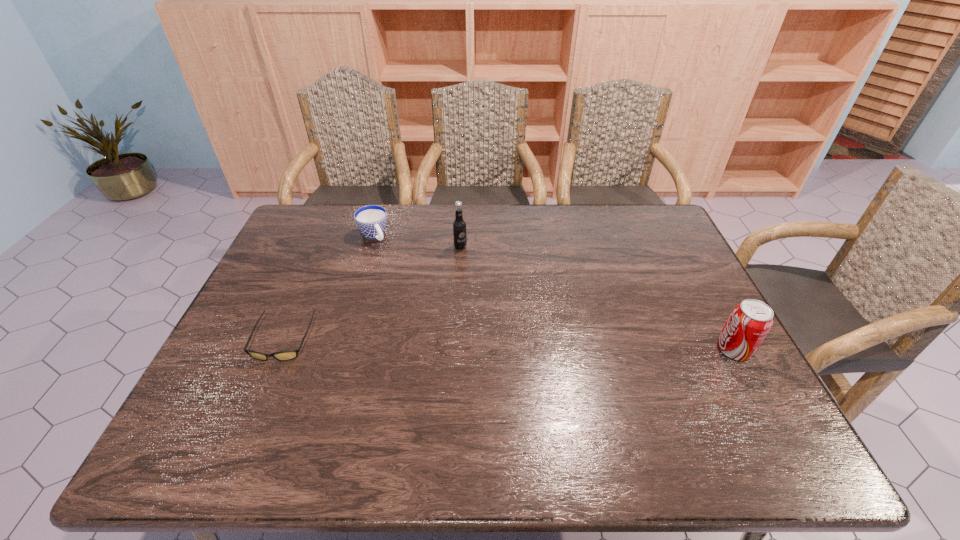
Where is `vacant space positioned 0.390m on the side of the second object from left to right with the handle`? vacant space positioned 0.390m on the side of the second object from left to right with the handle is located at coordinates pyautogui.click(x=436, y=321).

Locate an element on the screen. blank space located on the side of the second object from left to right with the handle is located at coordinates click(x=387, y=255).

The width and height of the screenshot is (960, 540). In order to click on free space located on the label of the root beer in this screenshot , I will do `click(535, 327)`.

Where is `vacant region located 0.360m on the label of the root beer`? The image size is (960, 540). vacant region located 0.360m on the label of the root beer is located at coordinates (531, 322).

You are a GUI agent. You are given a task and a screenshot of the screen. Output one action in this format:
    pyautogui.click(x=<x>, y=<y>)
    Task: Click on the vacant region located on the label of the root beer
    The image size is (960, 540).
    Given the screenshot: What is the action you would take?
    pyautogui.click(x=489, y=278)

Where is `cup that is at the far edge`? Image resolution: width=960 pixels, height=540 pixels. cup that is at the far edge is located at coordinates (371, 220).

What are the coordinates of `root beer situated at the far edge` in the screenshot? It's located at (459, 225).

This screenshot has height=540, width=960. Identify the location of object present at the left edge. (286, 355).

Locate an element on the screen. This screenshot has width=960, height=540. object that is at the right edge is located at coordinates (750, 321).

The image size is (960, 540). What are the coordinates of `free point at the far edge` in the screenshot? It's located at (550, 218).